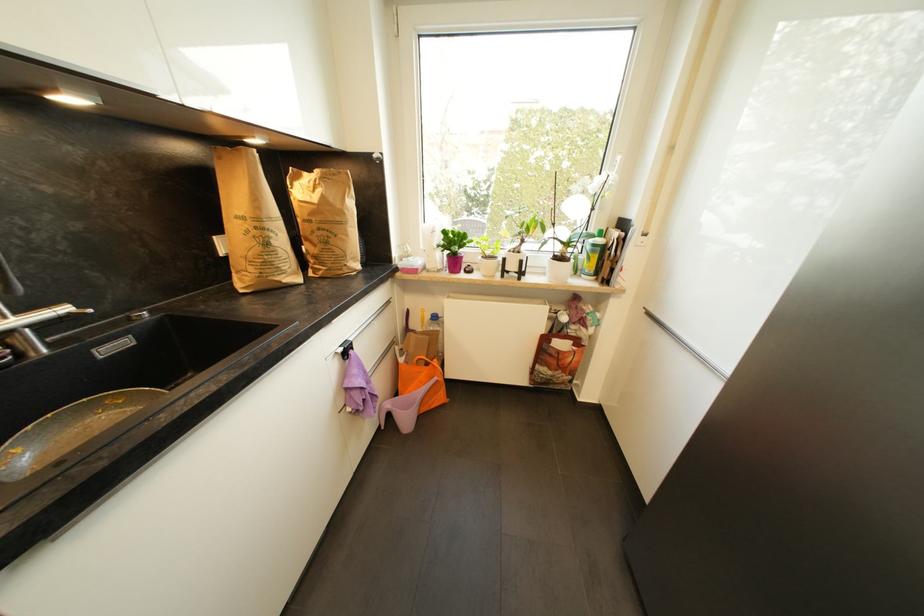
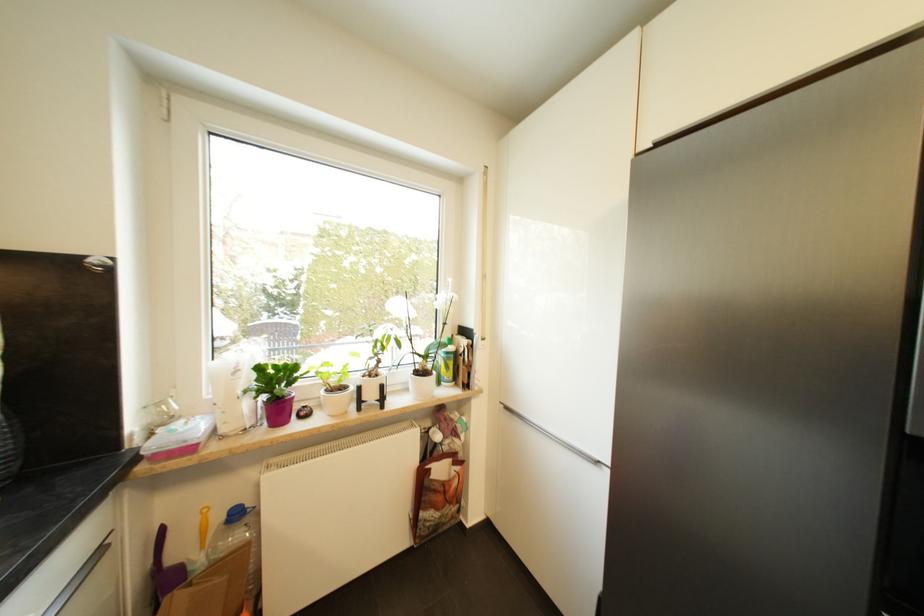
Where in the second image is the point corresponding to pixel 561 260 from the first image?

(421, 375)